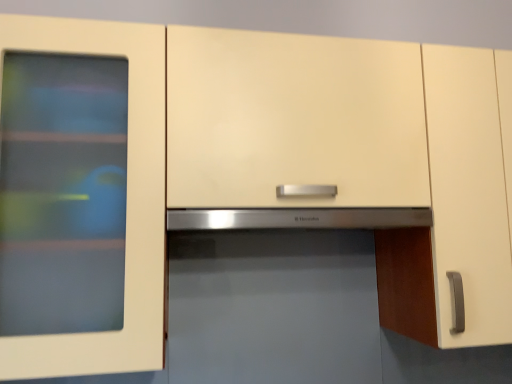
Where is `stainless steel exhaust hood at center`? Image resolution: width=512 pixels, height=384 pixels. stainless steel exhaust hood at center is located at coordinates (298, 218).

The image size is (512, 384). What do you see at coordinates (298, 218) in the screenshot? I see `stainless steel exhaust hood at center` at bounding box center [298, 218].

Consider the image. What is the approximate width of satin stainless steel microwave at center?

The width of satin stainless steel microwave at center is 1.18 meters.

Find the location of a particular element. satin stainless steel microwave at center is located at coordinates (273, 307).

What do you see at coordinates (273, 307) in the screenshot? This screenshot has width=512, height=384. I see `satin stainless steel microwave at center` at bounding box center [273, 307].

Image resolution: width=512 pixels, height=384 pixels. Find the location of `stainless steel exhaust hood at center`. stainless steel exhaust hood at center is located at coordinates (298, 218).

Considering the relative positions of stainless steel exhaust hood at center and satin stainless steel microwave at center in the image provided, is stainless steel exhaust hood at center to the left of satin stainless steel microwave at center from the viewer's perspective?

Correct, you'll find stainless steel exhaust hood at center to the left of satin stainless steel microwave at center.

In the scene shown: Who is more distant, stainless steel exhaust hood at center or satin stainless steel microwave at center?

stainless steel exhaust hood at center is further away from the camera.

Considering the positions of points (255, 224) and (255, 251), is point (255, 224) closer to camera compared to point (255, 251)?

Yes, point (255, 224) is closer to viewer.

From the image's perspective, which is below, stainless steel exhaust hood at center or satin stainless steel microwave at center?

satin stainless steel microwave at center.

From a real-world perspective, which is physically above, stainless steel exhaust hood at center or satin stainless steel microwave at center?

stainless steel exhaust hood at center.

Considering the sizes of objects stainless steel exhaust hood at center and satin stainless steel microwave at center in the image provided, who is thinner, stainless steel exhaust hood at center or satin stainless steel microwave at center?

stainless steel exhaust hood at center.

Can you confirm if stainless steel exhaust hood at center is taller than satin stainless steel microwave at center?

Incorrect, the height of stainless steel exhaust hood at center is not larger of that of satin stainless steel microwave at center.

In terms of size, does stainless steel exhaust hood at center appear bigger or smaller than satin stainless steel microwave at center?

In the image, stainless steel exhaust hood at center appears to be smaller than satin stainless steel microwave at center.

Is stainless steel exhaust hood at center not within satin stainless steel microwave at center?

Yes, stainless steel exhaust hood at center is located beyond the bounds of satin stainless steel microwave at center.

Is stainless steel exhaust hood at center in contact with satin stainless steel microwave at center?

stainless steel exhaust hood at center and satin stainless steel microwave at center are clearly separated.

Is stainless steel exhaust hood at center looking in the opposite direction of satin stainless steel microwave at center?

stainless steel exhaust hood at center does not have its back to satin stainless steel microwave at center.

How many degrees apart are the facing directions of stainless steel exhaust hood at center and satin stainless steel microwave at center?

stainless steel exhaust hood at center and satin stainless steel microwave at center are facing 0.832 degrees away from each other.

This screenshot has width=512, height=384. What are the coordinates of `appliance in front of the stainless steel exhaust hood at center` in the screenshot? It's located at (273, 307).

Between satin stainless steel microwave at center and stainless steel exhaust hood at center, which one appears on the right side from the viewer's perspective?

Positioned to the right is satin stainless steel microwave at center.

Considering the relative positions of satin stainless steel microwave at center and stainless steel exhaust hood at center in the image provided, is satin stainless steel microwave at center in front of stainless steel exhaust hood at center?

Yes, satin stainless steel microwave at center is in front of stainless steel exhaust hood at center.

Between point (242, 248) and point (264, 213), which one is positioned in front?

Positioned in front is point (264, 213).

From the image's perspective, is satin stainless steel microwave at center positioned above or below stainless steel exhaust hood at center?

Clearly, from the image's perspective, satin stainless steel microwave at center is below stainless steel exhaust hood at center.

From a real-world perspective, is satin stainless steel microwave at center physically located above or below stainless steel exhaust hood at center?

From a real-world perspective, satin stainless steel microwave at center is physically below stainless steel exhaust hood at center.

Is satin stainless steel microwave at center thinner than stainless steel exhaust hood at center?

In fact, satin stainless steel microwave at center might be wider than stainless steel exhaust hood at center.

Which of these two, satin stainless steel microwave at center or stainless steel exhaust hood at center, stands shorter?

stainless steel exhaust hood at center is shorter.

Which of these two, satin stainless steel microwave at center or stainless steel exhaust hood at center, is bigger?

Bigger between the two is satin stainless steel microwave at center.

Would you say stainless steel exhaust hood at center is part of satin stainless steel microwave at center's contents?

Actually, stainless steel exhaust hood at center is outside satin stainless steel microwave at center.

Is satin stainless steel microwave at center placed right next to stainless steel exhaust hood at center?

No, satin stainless steel microwave at center is not next to stainless steel exhaust hood at center.

Is satin stainless steel microwave at center positioned with its back to stainless steel exhaust hood at center?

That's not correct — satin stainless steel microwave at center is not looking away from stainless steel exhaust hood at center.

How many degrees apart are the facing directions of satin stainless steel microwave at center and stainless steel exhaust hood at center?

The facing directions of satin stainless steel microwave at center and stainless steel exhaust hood at center are 0.832 degrees apart.

How distant is satin stainless steel microwave at center from stainless steel exhaust hood at center?

satin stainless steel microwave at center and stainless steel exhaust hood at center are 8.84 inches apart.

In the image, there is a stainless steel exhaust hood at center. Where is `appliance below it (from the image's perspective)`? appliance below it (from the image's perspective) is located at coordinates (273, 307).

Find the location of a particular element. This screenshot has width=512, height=384. appliance lying in front of the stainless steel exhaust hood at center is located at coordinates (273, 307).

This screenshot has height=384, width=512. What are the coordinates of `exhaust hood located above the satin stainless steel microwave at center (from a real-world perspective)` in the screenshot? It's located at (298, 218).